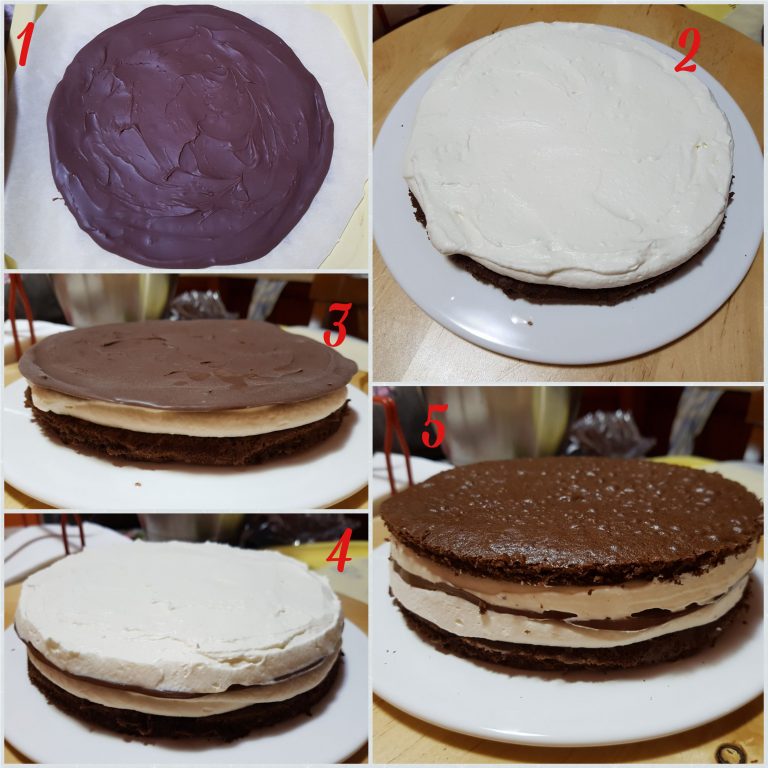
You are a GUI agent. You are given a task and a screenshot of the screen. Output one action in this format:
    pyautogui.click(x=<x>, y=<y>)
    Task: Click on the plate
    
    Given the screenshot: What is the action you would take?
    pyautogui.click(x=508, y=682), pyautogui.click(x=333, y=725), pyautogui.click(x=303, y=491), pyautogui.click(x=485, y=310)